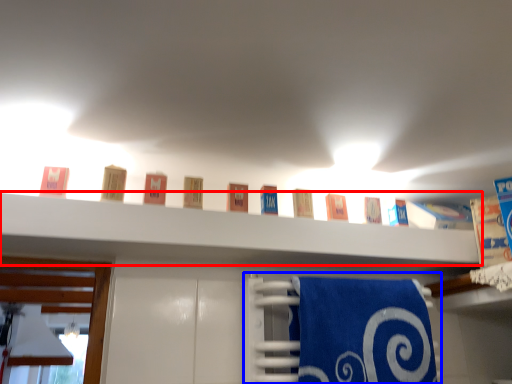
Question: Which object is further to the camera taking this photo, shelf (highlighted by a red box) or bath towel (highlighted by a blue box)?

Choices:
 (A) shelf
 (B) bath towel

Answer: (B)